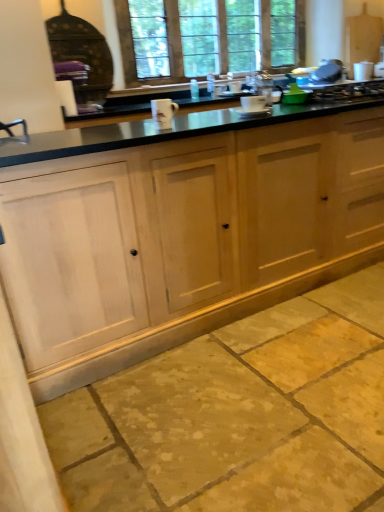
Question: Is metallic silver gas stove at upper right at the back of natural wood cabinets at center?

Choices:
 (A) yes
 (B) no

Answer: (B)

Question: Is natural wood cabinets at center behind metallic silver gas stove at upper right?

Choices:
 (A) yes
 (B) no

Answer: (B)

Question: Can you confirm if natural wood cabinets at center is wider than metallic silver gas stove at upper right?

Choices:
 (A) yes
 (B) no

Answer: (A)

Question: Is natural wood cabinets at center shorter than metallic silver gas stove at upper right?

Choices:
 (A) no
 (B) yes

Answer: (A)

Question: Can you confirm if natural wood cabinets at center is smaller than metallic silver gas stove at upper right?

Choices:
 (A) no
 (B) yes

Answer: (A)

Question: In terms of width, does natural stone floor at lower center look wider or thinner when compared to natural wood cabinets at center?

Choices:
 (A) thin
 (B) wide

Answer: (B)

Question: Considering the positions of natural stone floor at lower center and natural wood cabinets at center in the image, is natural stone floor at lower center taller or shorter than natural wood cabinets at center?

Choices:
 (A) tall
 (B) short

Answer: (B)

Question: Is point (192, 351) closer or farther from the camera than point (6, 266)?

Choices:
 (A) closer
 (B) farther

Answer: (B)

Question: Visually, is natural stone floor at lower center positioned to the left or to the right of natural wood cabinets at center?

Choices:
 (A) left
 (B) right

Answer: (B)

Question: From the image's perspective, is natural stone floor at lower center above or below clear glass window at upper center?

Choices:
 (A) above
 (B) below

Answer: (B)

Question: Is natural stone floor at lower center inside the boundaries of clear glass window at upper center, or outside?

Choices:
 (A) outside
 (B) inside

Answer: (A)

Question: Visually, is natural stone floor at lower center positioned to the left or to the right of clear glass window at upper center?

Choices:
 (A) right
 (B) left

Answer: (A)

Question: Looking at their shapes, would you say natural stone floor at lower center is wider or thinner than clear glass window at upper center?

Choices:
 (A) wide
 (B) thin

Answer: (A)

Question: From a real-world perspective, is white ceramic mug at center, marked as the second appliance in a right-to-left arrangement, above or below natural stone floor at lower center?

Choices:
 (A) above
 (B) below

Answer: (A)

Question: Is white ceramic mug at center, which is the 2th appliance from top to bottom, inside or outside of natural stone floor at lower center?

Choices:
 (A) inside
 (B) outside

Answer: (B)